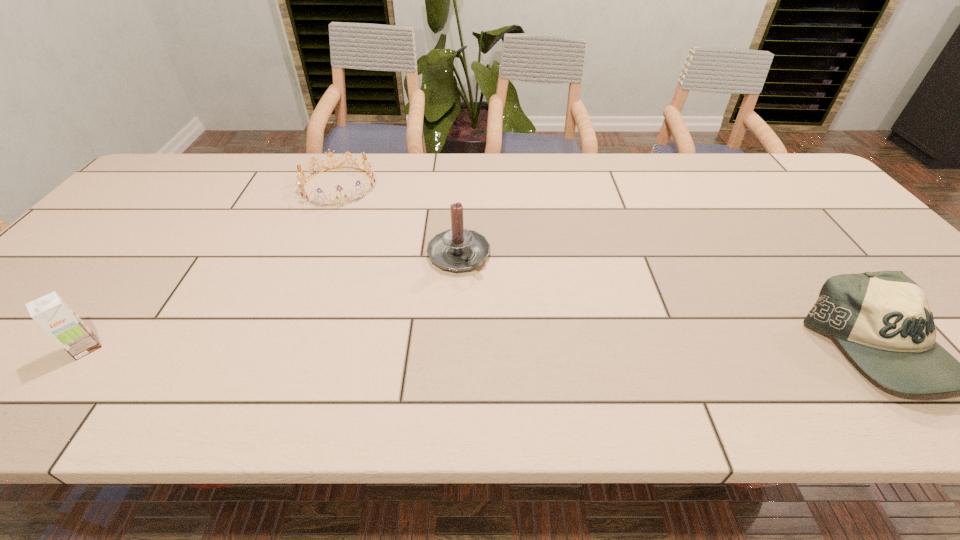
Identify the location of free space on the desktop that is between the chocolate milk and the baseball cap and is positioned on the front-facing side of the shortest object. (381, 348).

You are a GUI agent. You are given a task and a screenshot of the screen. Output one action in this format:
    pyautogui.click(x=<x>, y=<y>)
    Task: Click on the free space on the desktop that is between the chocolate milk and the third tallest object and is positioned on the side of the second farthest object with the handle loop
    
    Given the screenshot: What is the action you would take?
    pyautogui.click(x=554, y=348)